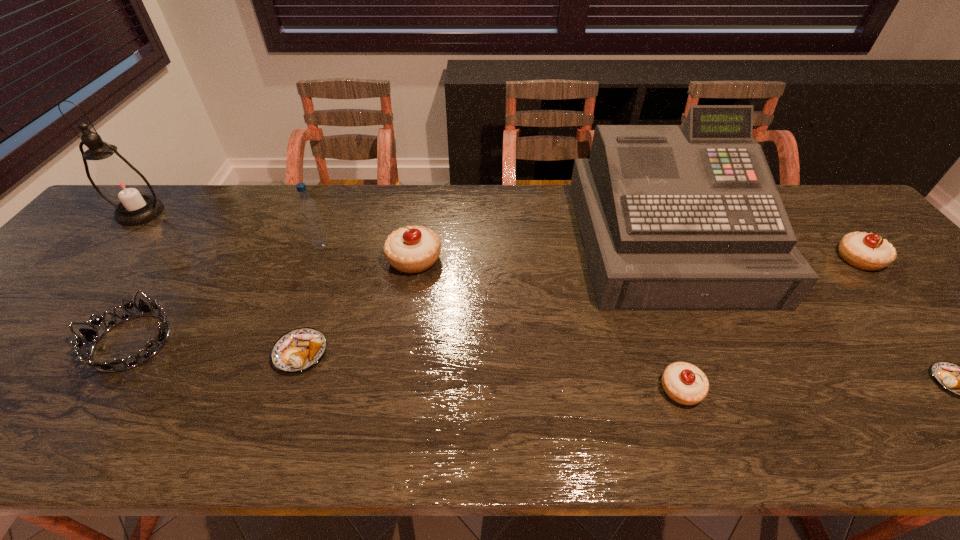
Where is `the third shortest pastry`? Image resolution: width=960 pixels, height=540 pixels. the third shortest pastry is located at coordinates (684, 383).

Image resolution: width=960 pixels, height=540 pixels. Identify the location of the bigger brown pastry. (300, 349).

Find the location of a particular element. the second shortest object is located at coordinates (300, 349).

Find the location of `free space located on the right of the oil lamp`. free space located on the right of the oil lamp is located at coordinates (214, 213).

You are a GUI agent. You are given a task and a screenshot of the screen. Output one action in this format:
    pyautogui.click(x=<x>, y=<y>)
    Task: Click on the free space located on the front-facing side of the cash register
    This screenshot has width=960, height=540.
    Given the screenshot: What is the action you would take?
    pyautogui.click(x=715, y=353)

You are a GUI agent. You are given a task and a screenshot of the screen. Output one action in this format:
    pyautogui.click(x=<x>, y=<y>)
    Task: Click on the vacant space located 0.190m on the left of the third tallest object
    
    Given the screenshot: What is the action you would take?
    pyautogui.click(x=243, y=245)

Locate an element on the screen. Image resolution: width=960 pixels, height=540 pixels. free region located 0.100m on the right of the leftmost beige pastry is located at coordinates (479, 259).

What are the coordinates of `free point located 0.350m on the left of the rightmost beige pastry` in the screenshot? It's located at click(707, 259).

Find the location of `vacant position located on the front-facing side of the tiara`. vacant position located on the front-facing side of the tiara is located at coordinates click(308, 342).

Find the location of a particular element. blank space located 0.210m on the left of the smallest beige pastry is located at coordinates (559, 389).